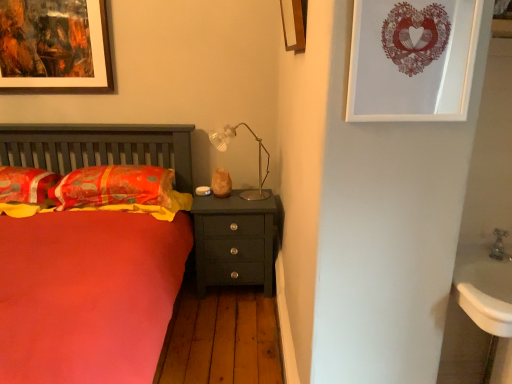
Locate an element on the screen. The height and width of the screenshot is (384, 512). matte dark green nightstand at center is located at coordinates (233, 241).

Describe the element at coordinates (258, 157) in the screenshot. The width and height of the screenshot is (512, 384). I see `gold metallic table lamp at center` at that location.

You are a GUI agent. You are given a task and a screenshot of the screen. Output one action in this format:
    pyautogui.click(x=<x>, y=<y>)
    Task: Click on the matte dark green nightstand at center
    The image size is (512, 384).
    Given the screenshot: What is the action you would take?
    pyautogui.click(x=233, y=241)

This screenshot has height=384, width=512. I want to click on the 3rd picture frame above the white glossy sink at lower right (from a real-world perspective), so click(294, 24).

Consider the image. Which is correct: white glossy sink at lower right is inside wooden picture frame at upper center, which appears as the 2th picture frame when viewed from the back, or outside of it?

white glossy sink at lower right lies outside wooden picture frame at upper center, which appears as the 2th picture frame when viewed from the back.

Is white glossy sink at lower right in front of or behind wooden picture frame at upper center, which appears as the 2th picture frame when viewed from the front, in the image?

Visually, white glossy sink at lower right is located in front of wooden picture frame at upper center, which appears as the 2th picture frame when viewed from the front.

From the image's perspective, is wooden picture frame at upper center, which appears as the 2th picture frame when viewed from the back, positioned above or below gold metallic table lamp at center?

wooden picture frame at upper center, which appears as the 2th picture frame when viewed from the back, is above gold metallic table lamp at center.

Which is less distant, [300,28] or [269,195]?

The point [300,28] is more forward.

Is wooden picture frame at upper center, the 2th picture frame in the left-to-right sequence, in contact with gold metallic table lamp at center?

No, wooden picture frame at upper center, the 2th picture frame in the left-to-right sequence, is not making contact with gold metallic table lamp at center.

The image size is (512, 384). I want to click on nightstand behind the matte paper picture frame at upper right, which ranks as the third picture frame in left-to-right order, so click(x=233, y=241).

Is matte paper picture frame at upper right, which appears as the 1th picture frame when viewed from the front, positioned behind matte dark green nightstand at center?

No, matte paper picture frame at upper right, which appears as the 1th picture frame when viewed from the front, is closer to the camera.

From the image's perspective, who appears lower, matte paper picture frame at upper right, which appears as the 1th picture frame when viewed from the front, or matte dark green nightstand at center?

matte dark green nightstand at center appears lower in the image.

Can you confirm if matte paper picture frame at upper right, which ranks as the third picture frame in left-to-right order, is wider than matte dark green nightstand at center?

No, matte paper picture frame at upper right, which ranks as the third picture frame in left-to-right order, is not wider than matte dark green nightstand at center.

Is point (479, 314) less distant than point (69, 176)?

Yes, point (479, 314) is in front of point (69, 176).

Based on the photo, would you say white glossy sink at lower right is inside or outside velvety orange pillow at left, the 1th pillow positioned from the right?

white glossy sink at lower right is outside velvety orange pillow at left, the 1th pillow positioned from the right.

Based on the photo, is white glossy sink at lower right at the right side of velvety orange pillow at left, which ranks as the 2th pillow in left-to-right order?

Yes.

From the image's perspective, relative to matte paper picture frame at upper right, which ranks as the 1th picture frame in right-to-left order, is gold metallic table lamp at center above or below?

From the image's perspective, gold metallic table lamp at center appears below matte paper picture frame at upper right, which ranks as the 1th picture frame in right-to-left order.

Is gold metallic table lamp at center looking in the opposite direction of matte paper picture frame at upper right, which is the third picture frame from back to front?

gold metallic table lamp at center is not turned away from matte paper picture frame at upper right, which is the third picture frame from back to front.

Identify the location of table lamp behind the matte paper picture frame at upper right, which ranks as the 1th picture frame in right-to-left order. The image size is (512, 384). (258, 157).

Which is nearer, (216, 137) or (352, 100)?

Point (352, 100)

From a real-world perspective, which object rests below the other?

white glossy sink at lower right, from a real-world perspective.

Between metallic silver faucet at lower right and white glossy sink at lower right, which one has less height?

metallic silver faucet at lower right is shorter.

In the image, is metallic silver faucet at lower right positioned in front of or behind white glossy sink at lower right?

Clearly, metallic silver faucet at lower right is behind white glossy sink at lower right.

Is metallic silver faucet at lower right smaller than white glossy sink at lower right?

Indeed, metallic silver faucet at lower right has a smaller size compared to white glossy sink at lower right.

From a real-world perspective, is wooden picture frame at upper center, which appears as the 2th picture frame when viewed from the back, under metallic silver faucet at lower right?

Incorrect, from a real-world perspective, wooden picture frame at upper center, which appears as the 2th picture frame when viewed from the back, is higher than metallic silver faucet at lower right.

How distant is wooden picture frame at upper center, which appears as the 2th picture frame when viewed from the back, from metallic silver faucet at lower right?

3.42 feet.

From the image's perspective, is wooden picture frame at upper center, the 2th picture frame in the left-to-right sequence, above metallic silver faucet at lower right?

Correct, wooden picture frame at upper center, the 2th picture frame in the left-to-right sequence, appears higher than metallic silver faucet at lower right in the image.

Is wooden picture frame at upper center, the 2th picture frame in the left-to-right sequence, oriented towards metallic silver faucet at lower right?

No.

From the image's perspective, starting from the white glossy sink at lower right, which picture frame is the 2nd one above? Please provide its 2D coordinates.

[(294, 24)]

This screenshot has height=384, width=512. Find the location of `picture frame that is the 1st object to the right of the gold metallic table lamp at center, starting at the anchor`. picture frame that is the 1st object to the right of the gold metallic table lamp at center, starting at the anchor is located at coordinates (294, 24).

Which object lies nearer to the anchor point matte orange pillow at left, which is the 2th pillow from right to left, metallic silver faucet at lower right or wooden picture frame at upper center, which ranks as the second picture frame in right-to-left order?

Result: wooden picture frame at upper center, which ranks as the second picture frame in right-to-left order.

Based on their spatial positions, is matte dark green nightstand at center or white glossy sink at lower right further from wooden picture frame at upper center, the 2th picture frame in the left-to-right sequence?

matte dark green nightstand at center is further to wooden picture frame at upper center, the 2th picture frame in the left-to-right sequence.

When comparing their distances from matte orange pillow at left, which is the 2th pillow from right to left, does matte dark green nightstand at center or wooden framed artwork at upper left, which is the 3th picture frame in front-to-back order, seem further?

matte dark green nightstand at center.

Considering their positions, is matte paper picture frame at upper right, which ranks as the 1th picture frame in right-to-left order, positioned closer to matte dark green nightstand at center than velvety orange pillow at left, the 1th pillow positioned from the right?

velvety orange pillow at left, the 1th pillow positioned from the right, lies closer to matte dark green nightstand at center than the other object.

When comparing their distances from matte paper picture frame at upper right, which appears as the 1th picture frame when viewed from the front, does matte orange pillow at left, marked as the 1th pillow in a left-to-right arrangement, or white glossy sink at lower right seem further?

The object further to matte paper picture frame at upper right, which appears as the 1th picture frame when viewed from the front, is matte orange pillow at left, marked as the 1th pillow in a left-to-right arrangement.

Considering their positions, is velvety orange pillow at left, the 1th pillow positioned from the right, positioned closer to matte dark green nightstand at center than white glossy sink at lower right?

velvety orange pillow at left, the 1th pillow positioned from the right, lies closer to matte dark green nightstand at center than the other object.

Looking at this image, considering their positions, is matte orange blanket at left positioned closer to white glossy sink at lower right than metallic silver faucet at lower right?

metallic silver faucet at lower right is closer to white glossy sink at lower right.

From the image, which object appears to be nearer to gold metallic table lamp at center, wooden framed artwork at upper left, which is the 3th picture frame in front-to-back order, or white glossy sink at lower right?

wooden framed artwork at upper left, which is the 3th picture frame in front-to-back order, is positioned closer to the anchor gold metallic table lamp at center.

Identify the location of blanket between wooden framed artwork at upper left, which is counted as the 1th picture frame, starting from the back, and metallic silver faucet at lower right, in the horizontal direction. (149, 207).

At what (x,y) coordinates should I click in order to perform the action: click on nightstand between matte orange blanket at left and metallic silver faucet at lower right from left to right. Please return your answer as a coordinate pair (x, y). Looking at the image, I should click on (233, 241).

I want to click on blanket between wooden picture frame at upper center, which appears as the 2th picture frame when viewed from the back, and matte dark green nightstand at center in the up-down direction, so click(149, 207).

Locate an element on the screen. This screenshot has width=512, height=384. picture frame between matte paper picture frame at upper right, which appears as the 1th picture frame when viewed from the front, and matte orange blanket at left, along the z-axis is located at coordinates (294, 24).